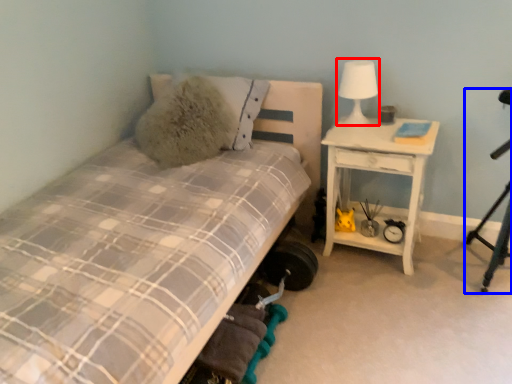
Question: Which point is closer to the camera, table lamp (highlighted by a red box) or tripod (highlighted by a blue box)?

Choices:
 (A) table lamp
 (B) tripod

Answer: (B)